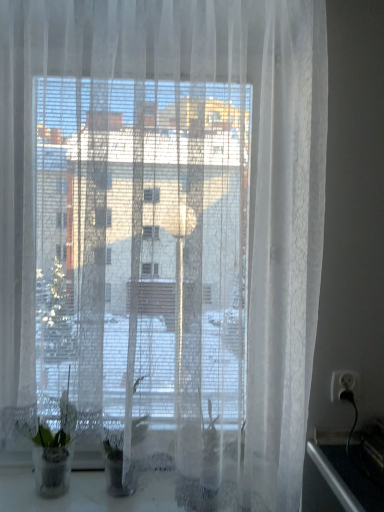
Where is `green matte plant at lower left`? This screenshot has width=384, height=512. green matte plant at lower left is located at coordinates (52, 449).

Describe the element at coordinates (52, 449) in the screenshot. The width and height of the screenshot is (384, 512). I see `green matte plant at lower left` at that location.

Where is `green matte plant at lower left`? This screenshot has width=384, height=512. green matte plant at lower left is located at coordinates (52, 449).